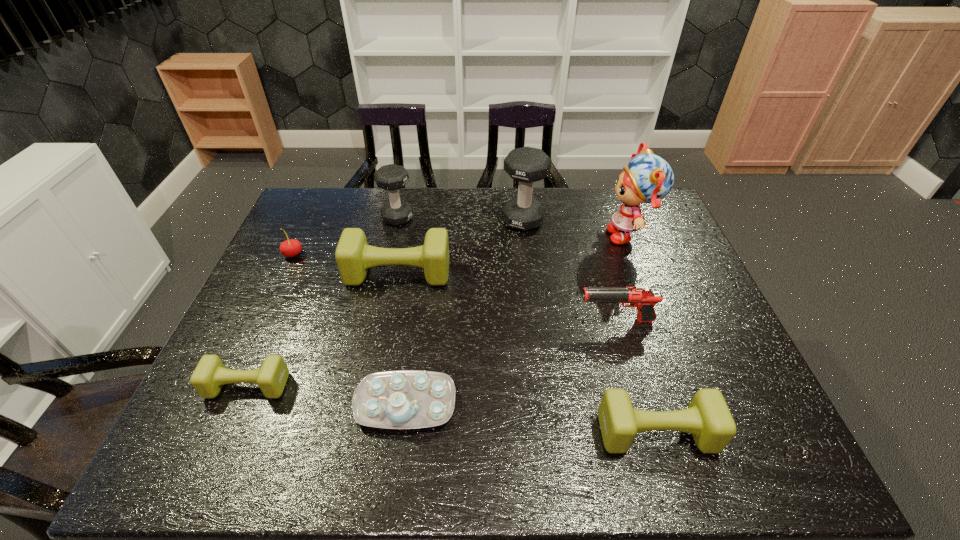
Image resolution: width=960 pixels, height=540 pixels. In order to click on vacant space located on the front of the farthest olive dumbbell in this screenshot , I will do `click(387, 333)`.

Image resolution: width=960 pixels, height=540 pixels. In order to click on blank area located at the aiming end of the black gun in this screenshot , I will do `click(484, 321)`.

Find the location of a particular element. blank area located at the aiming end of the black gun is located at coordinates (488, 321).

Find the location of `free spot located 0.050m at the aiming end of the black gun`. free spot located 0.050m at the aiming end of the black gun is located at coordinates (559, 321).

Where is `vacant space located on the right of the cherry`? vacant space located on the right of the cherry is located at coordinates (404, 255).

You are a GUI agent. You are given a task and a screenshot of the screen. Output one action in this format:
    pyautogui.click(x=<x>, y=<y>)
    Task: Click on the vacant space located 0.400m on the left of the nearest dumbbell
    This screenshot has width=960, height=540.
    Given the screenshot: What is the action you would take?
    pyautogui.click(x=413, y=433)

Identify the location of free location located on the left of the blue chinaware. (219, 403).

This screenshot has height=540, width=960. I want to click on free space located 0.220m on the right of the smallest olive dumbbell, so click(381, 386).

Find the location of `doll located at the far edge`. doll located at the far edge is located at coordinates 648,178.

The width and height of the screenshot is (960, 540). I want to click on dumbbell that is at the near edge, so click(707, 417).